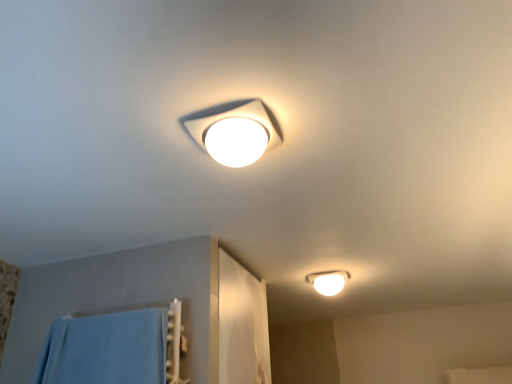
The width and height of the screenshot is (512, 384). I want to click on white glossy light fixture at lower right, marked as the 1th lamp in a back-to-front arrangement, so click(328, 281).

What do you see at coordinates (328, 281) in the screenshot?
I see `white glossy light fixture at lower right, which ranks as the 1th lamp in bottom-to-top order` at bounding box center [328, 281].

What do you see at coordinates (234, 131) in the screenshot?
I see `white matte lamp at upper center, the 2th lamp in the right-to-left sequence` at bounding box center [234, 131].

You are a GUI agent. You are given a task and a screenshot of the screen. Output one action in this format:
    pyautogui.click(x=<x>, y=<y>)
    Task: Click on the white matte lamp at upper center, arranged as the 2th lamp when viewed from the back
    
    Given the screenshot: What is the action you would take?
    pyautogui.click(x=234, y=131)

At what (x,y) coordinates should I click in order to perform the action: click on white glossy light fixture at lower right, marked as the 1th lamp in a back-to-front arrangement. Please return your answer as a coordinate pair (x, y). Image resolution: width=512 pixels, height=384 pixels. Looking at the image, I should click on pos(328,281).

Considering the positions of objects white matte lamp at upper center, arranged as the 2th lamp when viewed from the back, and white glossy light fixture at lower right, placed as the second lamp when sorted from top to bottom, in the image provided, who is more to the right, white matte lamp at upper center, arranged as the 2th lamp when viewed from the back, or white glossy light fixture at lower right, placed as the second lamp when sorted from top to bottom,?

From the viewer's perspective, white glossy light fixture at lower right, placed as the second lamp when sorted from top to bottom, appears more on the right side.

Between white matte lamp at upper center, the 2th lamp in the right-to-left sequence, and white glossy light fixture at lower right, placed as the second lamp when sorted from top to bottom, which one is positioned in front?

white matte lamp at upper center, the 2th lamp in the right-to-left sequence, is closer to the camera.

Does point (220, 151) lie in front of point (334, 290)?

Yes.

From the image's perspective, relative to white glossy light fixture at lower right, which ranks as the 1th lamp in bottom-to-top order, is white matte lamp at upper center, which is counted as the 2th lamp, starting from the bottom, above or below?

white matte lamp at upper center, which is counted as the 2th lamp, starting from the bottom, is above white glossy light fixture at lower right, which ranks as the 1th lamp in bottom-to-top order.

From a real-world perspective, is white matte lamp at upper center, arranged as the 2th lamp when viewed from the back, physically located above or below white glossy light fixture at lower right, placed as the second lamp when sorted from top to bottom?

white matte lamp at upper center, arranged as the 2th lamp when viewed from the back, is situated lower than white glossy light fixture at lower right, placed as the second lamp when sorted from top to bottom, in the real world.

Considering the relative sizes of white matte lamp at upper center, the 1th lamp when ordered from top to bottom, and white glossy light fixture at lower right, which is counted as the second lamp, starting from the left, in the image provided, is white matte lamp at upper center, the 1th lamp when ordered from top to bottom, wider than white glossy light fixture at lower right, which is counted as the second lamp, starting from the left,?

In fact, white matte lamp at upper center, the 1th lamp when ordered from top to bottom, might be narrower than white glossy light fixture at lower right, which is counted as the second lamp, starting from the left.

In terms of height, does white matte lamp at upper center, the 1th lamp when ordered from top to bottom, look taller or shorter compared to white glossy light fixture at lower right, which ranks as the 2th lamp in front-to-back order?

Considering their sizes, white matte lamp at upper center, the 1th lamp when ordered from top to bottom, has less height than white glossy light fixture at lower right, which ranks as the 2th lamp in front-to-back order.

Can you confirm if white matte lamp at upper center, which is counted as the 2th lamp, starting from the bottom, is bigger than white glossy light fixture at lower right, which is counted as the second lamp, starting from the left?

No, white matte lamp at upper center, which is counted as the 2th lamp, starting from the bottom, is not bigger than white glossy light fixture at lower right, which is counted as the second lamp, starting from the left.

Would you say white matte lamp at upper center, arranged as the 2th lamp when viewed from the back, is outside white glossy light fixture at lower right, which ranks as the 1th lamp in bottom-to-top order?

white matte lamp at upper center, arranged as the 2th lamp when viewed from the back, lies outside white glossy light fixture at lower right, which ranks as the 1th lamp in bottom-to-top order,'s area.

Is white matte lamp at upper center, which appears as the first lamp when viewed from the front, next to white glossy light fixture at lower right, which ranks as the 2th lamp in front-to-back order, and touching it?

There is a gap between white matte lamp at upper center, which appears as the first lamp when viewed from the front, and white glossy light fixture at lower right, which ranks as the 2th lamp in front-to-back order.

Is white glossy light fixture at lower right, marked as the 1th lamp in a back-to-front arrangement, at the back of white matte lamp at upper center, the 2th lamp in the right-to-left sequence?

No, white matte lamp at upper center, the 2th lamp in the right-to-left sequence, is not facing the opposite direction of white glossy light fixture at lower right, marked as the 1th lamp in a back-to-front arrangement.

How different are the orientations of white matte lamp at upper center, the 2th lamp in the right-to-left sequence, and white glossy light fixture at lower right, placed as the second lamp when sorted from top to bottom, in degrees?

90 degrees.

At what (x,y) coordinates should I click in order to perform the action: click on lamp behind the white matte lamp at upper center, which is counted as the 2th lamp, starting from the bottom. Please return your answer as a coordinate pair (x, y). The image size is (512, 384). Looking at the image, I should click on [x=328, y=281].

Is white glossy light fixture at lower right, which is counted as the second lamp, starting from the left, to the left of white matte lamp at upper center, which appears as the first lamp when viewed from the front, from the viewer's perspective?

Incorrect, white glossy light fixture at lower right, which is counted as the second lamp, starting from the left, is not on the left side of white matte lamp at upper center, which appears as the first lamp when viewed from the front.

In the image, is white glossy light fixture at lower right, which is counted as the first lamp, starting from the right, positioned in front of or behind white matte lamp at upper center, positioned as the 1th lamp in left-to-right order?

Visually, white glossy light fixture at lower right, which is counted as the first lamp, starting from the right, is located behind white matte lamp at upper center, positioned as the 1th lamp in left-to-right order.

Which is nearer, (339, 291) or (239, 127)?

Point (339, 291) is farther from the camera than point (239, 127).

From the image's perspective, does white glossy light fixture at lower right, placed as the second lamp when sorted from top to bottom, appear lower than white matte lamp at upper center, the 2th lamp in the right-to-left sequence?

Yes, from the image's perspective, white glossy light fixture at lower right, placed as the second lamp when sorted from top to bottom, is below white matte lamp at upper center, the 2th lamp in the right-to-left sequence.

In the scene shown: From a real-world perspective, does white glossy light fixture at lower right, marked as the 1th lamp in a back-to-front arrangement, stand above white matte lamp at upper center, the 1th lamp when ordered from top to bottom?

Yes, from a real-world perspective, white glossy light fixture at lower right, marked as the 1th lamp in a back-to-front arrangement, is over white matte lamp at upper center, the 1th lamp when ordered from top to bottom

Considering the sizes of white glossy light fixture at lower right, which ranks as the 2th lamp in front-to-back order, and white matte lamp at upper center, the 1th lamp when ordered from top to bottom, in the image, is white glossy light fixture at lower right, which ranks as the 2th lamp in front-to-back order, wider or thinner than white matte lamp at upper center, the 1th lamp when ordered from top to bottom,?

Clearly, white glossy light fixture at lower right, which ranks as the 2th lamp in front-to-back order, has more width compared to white matte lamp at upper center, the 1th lamp when ordered from top to bottom.

Who is taller, white glossy light fixture at lower right, which is counted as the first lamp, starting from the right, or white matte lamp at upper center, arranged as the 2th lamp when viewed from the back?

Standing taller between the two is white glossy light fixture at lower right, which is counted as the first lamp, starting from the right.

Does white glossy light fixture at lower right, which ranks as the 2th lamp in front-to-back order, have a larger size compared to white matte lamp at upper center, the 1th lamp when ordered from top to bottom?

Yes.

Is white glossy light fixture at lower right, which ranks as the 1th lamp in bottom-to-top order, inside the boundaries of white matte lamp at upper center, which is counted as the 2th lamp, starting from the bottom, or outside?

white glossy light fixture at lower right, which ranks as the 1th lamp in bottom-to-top order, lies outside white matte lamp at upper center, which is counted as the 2th lamp, starting from the bottom.

Are white glossy light fixture at lower right, which ranks as the 2th lamp in front-to-back order, and white matte lamp at upper center, which appears as the first lamp when viewed from the front, located far from each other?

Yes, white glossy light fixture at lower right, which ranks as the 2th lamp in front-to-back order, is far from white matte lamp at upper center, which appears as the first lamp when viewed from the front.

Based on the photo, is white glossy light fixture at lower right, placed as the second lamp when sorted from top to bottom, positioned with its back to white matte lamp at upper center, positioned as the 1th lamp in left-to-right order?

No, white glossy light fixture at lower right, placed as the second lamp when sorted from top to bottom,'s orientation is not away from white matte lamp at upper center, positioned as the 1th lamp in left-to-right order.

Locate an element on the screen. This screenshot has width=512, height=384. lamp lying on the right of white matte lamp at upper center, positioned as the 1th lamp in left-to-right order is located at coordinates (328, 281).

The height and width of the screenshot is (384, 512). I want to click on lamp located in front of the white glossy light fixture at lower right, which ranks as the 2th lamp in front-to-back order, so click(234, 131).

Identify the location of lamp on the left of white glossy light fixture at lower right, marked as the 1th lamp in a back-to-front arrangement. (234, 131).